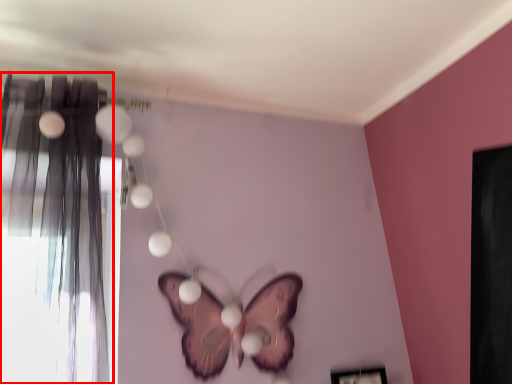
Question: From the image's perspective, considering the relative positions of curtain (annotated by the red box) and butterfly in the image provided, where is curtain (annotated by the red box) located with respect to the staircase?

Choices:
 (A) above
 (B) below

Answer: (A)